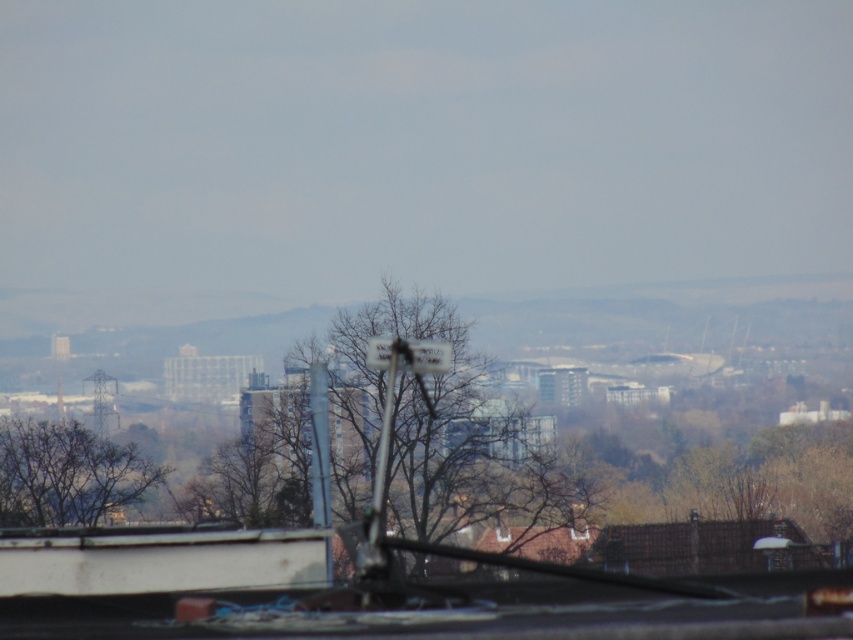
You are a city planner reviewing an aerial view of a city. You notice a brown leafless tree at lower left and a white plastic street sign at center. Which object is taller in the image?

The brown leafless tree at lower left is taller than the white plastic street sign at center.

You are standing on a rooftop and see a brown leafless tree at lower left and a white plastic street sign at center. Which object is closer to the ground?

The brown leafless tree at lower left is located below the white plastic street sign at center, so it is closer to the ground.